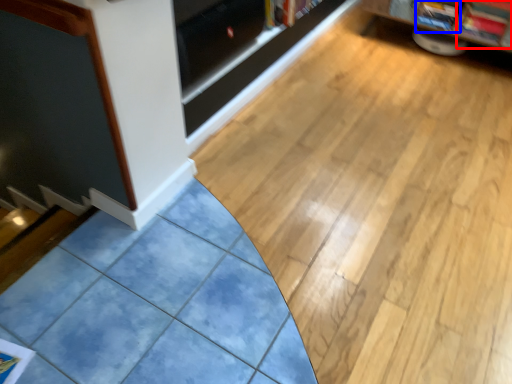
Question: Among these objects, which one is farthest to the camera, magazine (highlighted by a red box) or magazine (highlighted by a blue box)?

Choices:
 (A) magazine
 (B) magazine

Answer: (B)